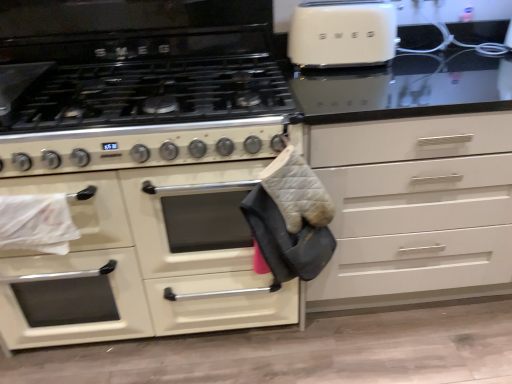
Question: Can we say white matte drawer at center lies outside matte white oven at center?

Choices:
 (A) yes
 (B) no

Answer: (A)

Question: Is white matte drawer at center surrounding matte white oven at center?

Choices:
 (A) yes
 (B) no

Answer: (B)

Question: Does white matte drawer at center turn towards matte white oven at center?

Choices:
 (A) yes
 (B) no

Answer: (B)

Question: From a real-world perspective, is white matte drawer at center below matte white oven at center?

Choices:
 (A) yes
 (B) no

Answer: (B)

Question: Is white matte drawer at center further to camera compared to matte white oven at center?

Choices:
 (A) yes
 (B) no

Answer: (B)

Question: Considering the relative positions of white matte drawer at center and matte white oven at center in the image provided, is white matte drawer at center to the left of matte white oven at center from the viewer's perspective?

Choices:
 (A) yes
 (B) no

Answer: (B)

Question: Would you say matte white oven at center contains white matte drawer at center?

Choices:
 (A) no
 (B) yes

Answer: (A)

Question: Is matte white oven at center facing away from white matte drawer at center?

Choices:
 (A) no
 (B) yes

Answer: (A)

Question: Can you confirm if matte white oven at center is smaller than white matte drawer at center?

Choices:
 (A) no
 (B) yes

Answer: (B)

Question: From a real-world perspective, is matte white oven at center physically above white matte drawer at center?

Choices:
 (A) yes
 (B) no

Answer: (B)

Question: Can you confirm if matte white oven at center is taller than white matte drawer at center?

Choices:
 (A) yes
 (B) no

Answer: (B)

Question: Does matte white oven at center have a greater width compared to white matte drawer at center?

Choices:
 (A) no
 (B) yes

Answer: (A)

Question: Is the depth of white matte drawer at center greater than that of gray quilted oven mitt at center?

Choices:
 (A) yes
 (B) no

Answer: (A)